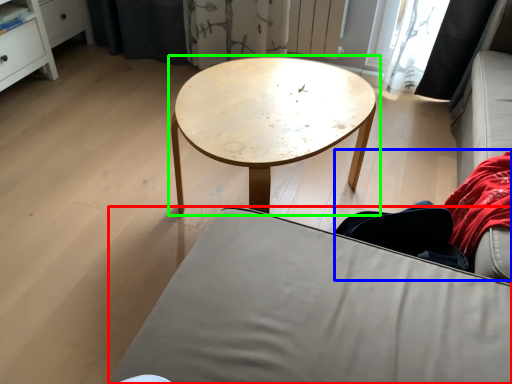
Question: Which object is the closest to the studio couch (highlighted by a red box)? Choose among these: couple (highlighted by a blue box) or coffee table (highlighted by a green box).

Choices:
 (A) couple
 (B) coffee table

Answer: (A)